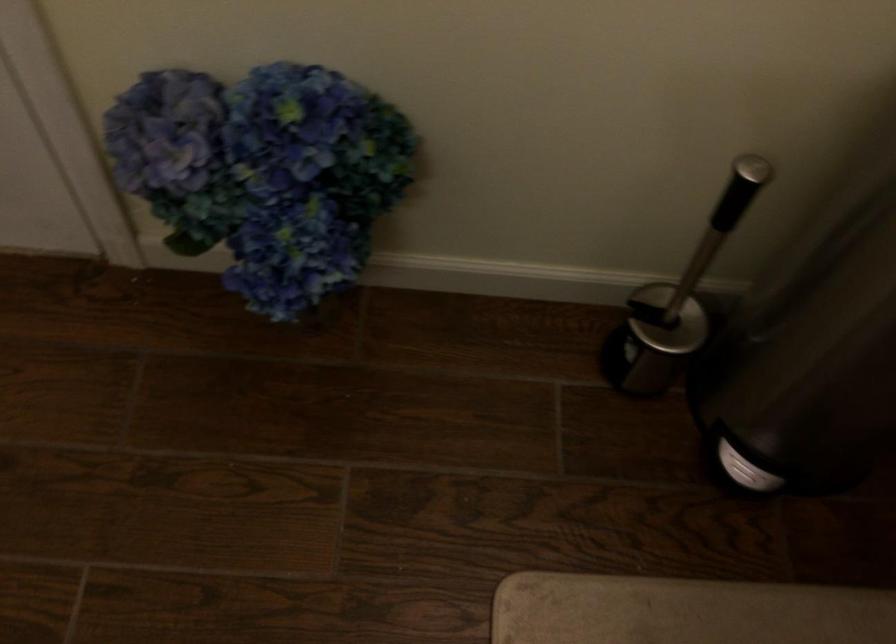
Find where to lift the toilet brush handle. Please return your answer as a coordinate pair (x, y).

(719, 225)